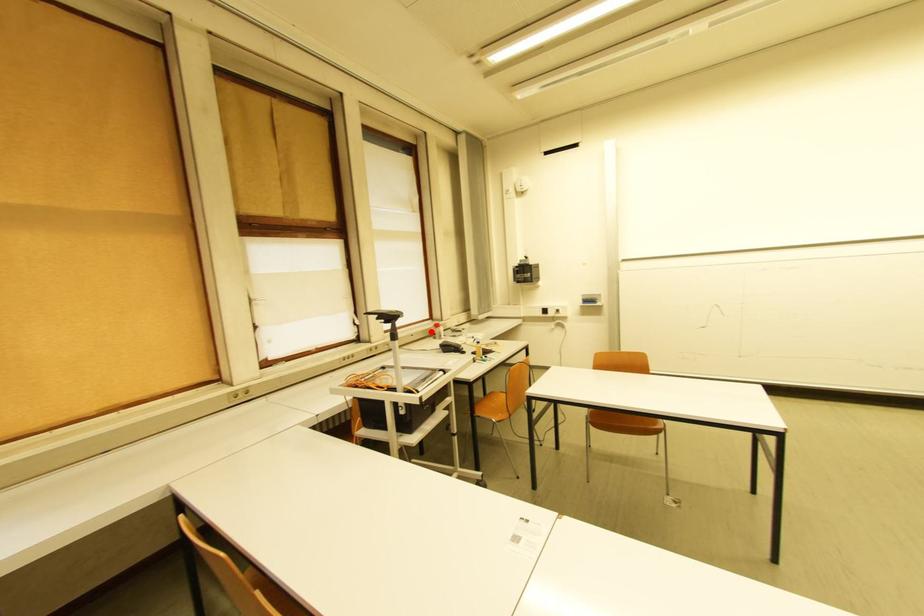
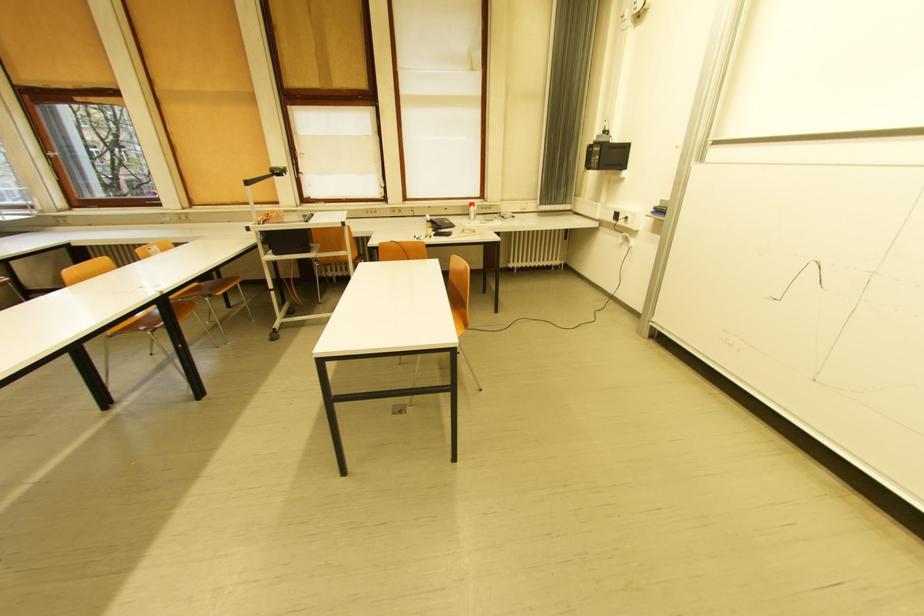
Question: I am providing you with two images of the same scene from different viewpoints. A red point is shown in image1. For the corresponding object point in image2, is it positioned nearer or farther from the camera?

Choices:
 (A) Nearer
 (B) Farther

Answer: (A)